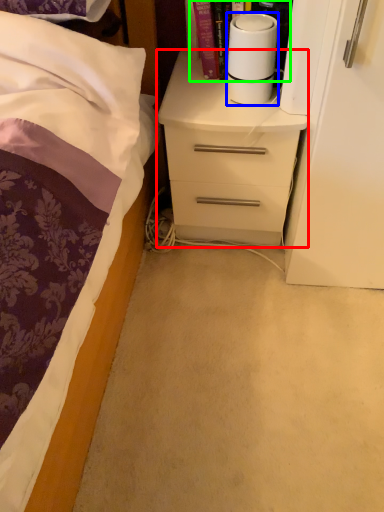
Question: Which is nearer to the chest of drawers (highlighted by a red box)? paper towel (highlighted by a blue box) or book (highlighted by a green box).

Choices:
 (A) paper towel
 (B) book

Answer: (A)